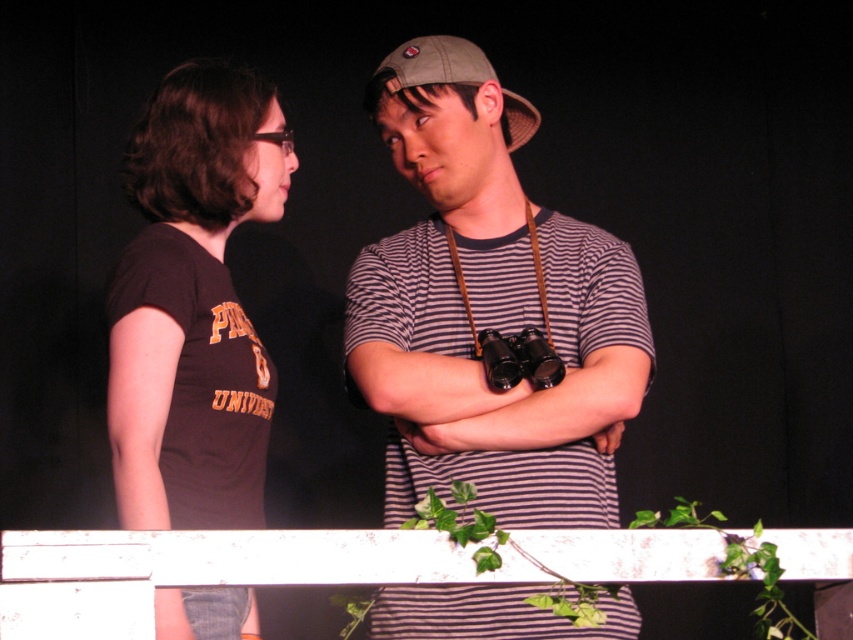
You are an event photographer who needs to capture a clear shot of both the white painted wood at center and the khaki fabric baseball cap at center. Since you want to ensure both are in frame, which object should you position closer to the left side of your camera viewfinder?

The white painted wood at center should be positioned closer to the left side of the camera viewfinder because it is already located to the left of the khaki fabric baseball cap at center.

You are a photographer at the event and want to capture a closeup of the striped fabric binoculars at center. Based on their position, where should you aim your camera?

The striped fabric binoculars at center are located at point coordinates of 0.483 on the x axis and 0.574 on the y axis. Aim your camera at those coordinates to capture the binoculars.

You are a photographer trying to capture a clear photo of the striped fabric binoculars at center and the white painted wood at center. Which object should you focus on first if you want to ensure both are in focus, considering their sizes?

The striped fabric binoculars at center has a larger size compared to white painted wood at center, so focusing on the larger object first would help ensure both are in focus.